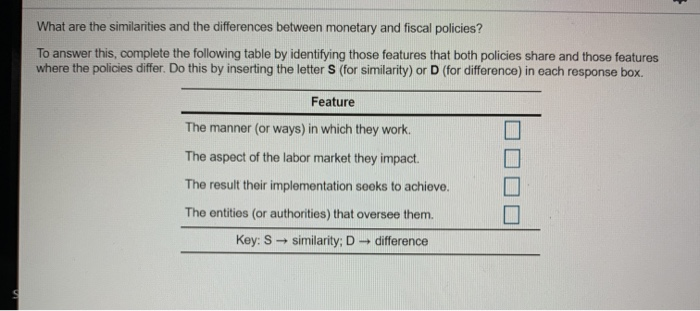
The image size is (700, 311). What are the coordinates of `box` in the screenshot? It's located at (626, 74).